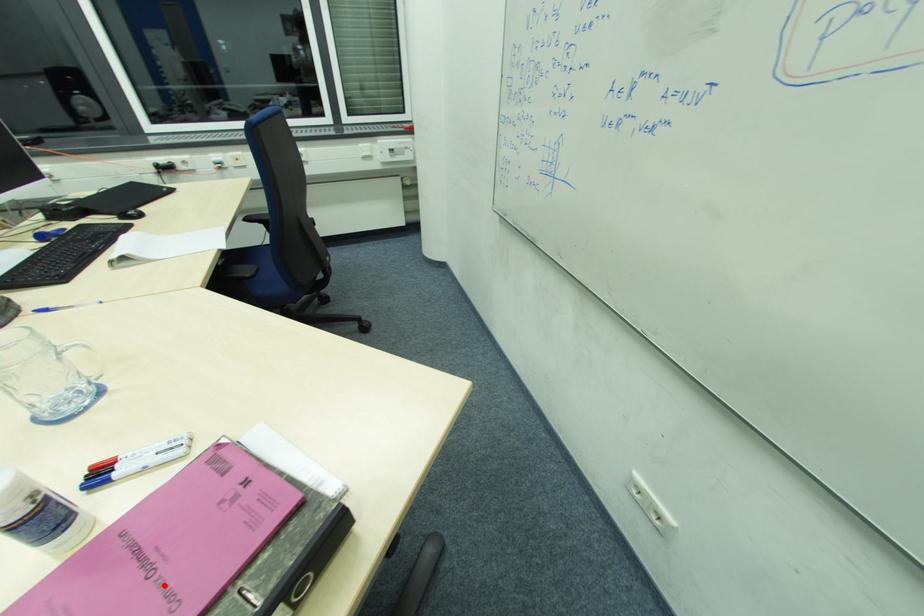
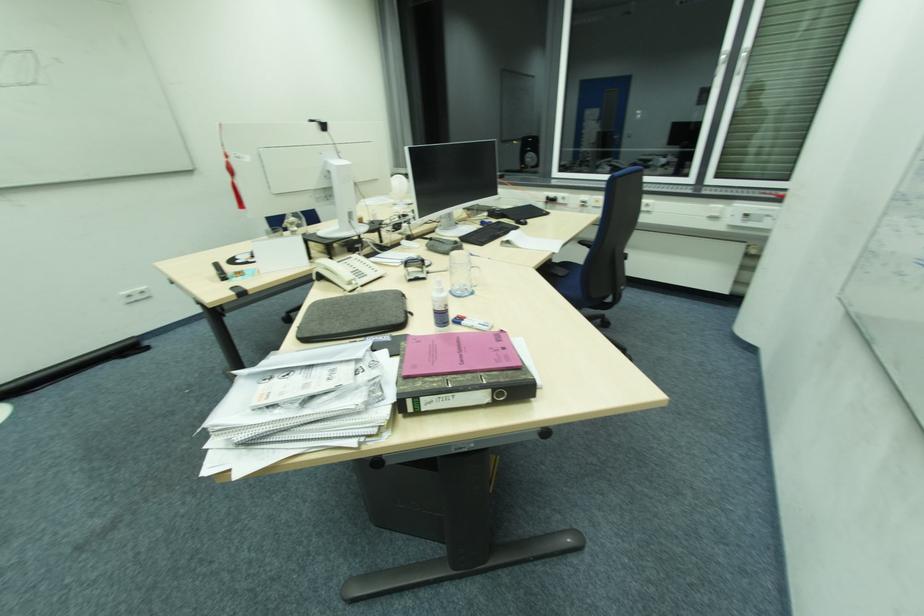
The point at the highlighted location is marked in the first image. Where is the corresponding point in the second image?

(465, 357)